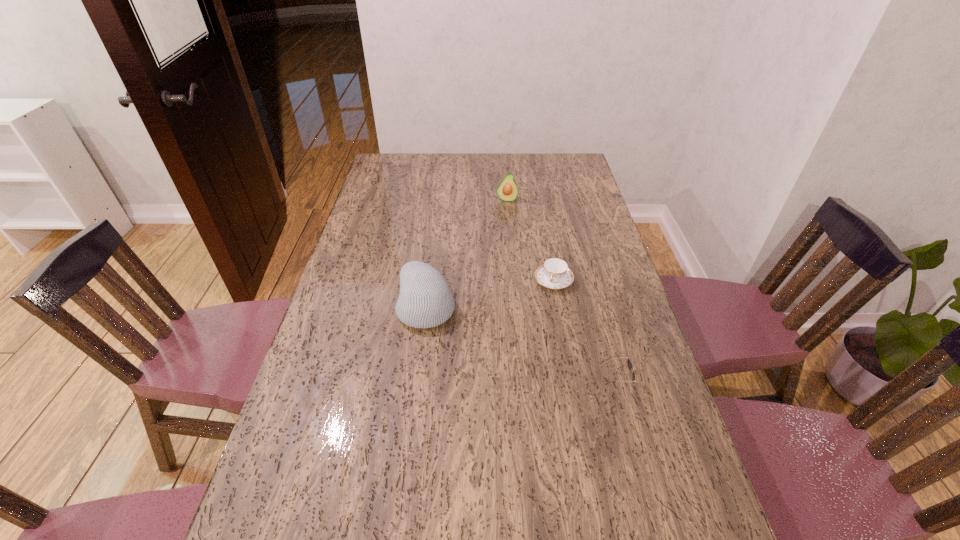
Identify the location of beanie. (425, 300).

At what (x,y) coordinates should I click in order to perform the action: click on the rightmost object. Please return your answer as a coordinate pair (x, y). The width and height of the screenshot is (960, 540). Looking at the image, I should click on (630, 365).

Identify the location of the second shortest object. Image resolution: width=960 pixels, height=540 pixels. (630, 365).

The height and width of the screenshot is (540, 960). I want to click on the third object from left to right, so click(554, 273).

Where is `teacup`? The width and height of the screenshot is (960, 540). teacup is located at coordinates (554, 273).

Image resolution: width=960 pixels, height=540 pixels. Find the location of `avocado`. avocado is located at coordinates (507, 190).

At what (x,y) coordinates should I click in order to perform the action: click on the second object from left to right. Please return your answer as a coordinate pair (x, y). Looking at the image, I should click on (507, 190).

You are a GUI agent. You are given a task and a screenshot of the screen. Output one action in this format:
    pyautogui.click(x=<x>, y=<y>)
    Task: Click on the vacant space located 0.060m on the left of the beanie
    
    Given the screenshot: What is the action you would take?
    pyautogui.click(x=377, y=306)

Where is `vacant region located 0.190m on the side with the handle of the third object from left to right`? vacant region located 0.190m on the side with the handle of the third object from left to right is located at coordinates (533, 339).

This screenshot has width=960, height=540. In order to click on blank area located 0.270m on the side with the handle of the third object from left to right in this screenshot , I will do `click(524, 361)`.